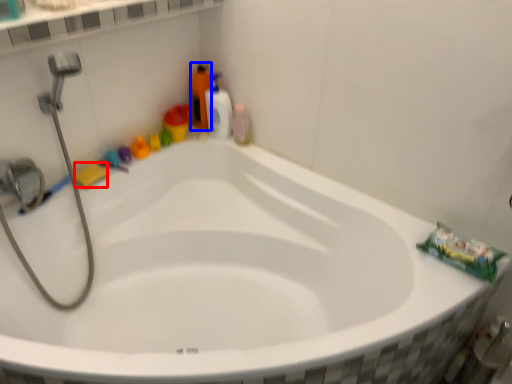
Question: Which object is closer to the camera taking this photo, soap (highlighted by a red box) or cleaning product (highlighted by a blue box)?

Choices:
 (A) soap
 (B) cleaning product

Answer: (A)